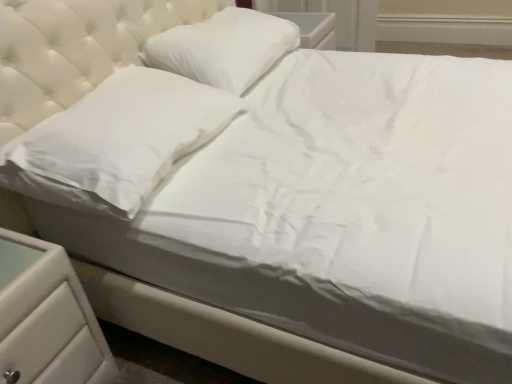
Question: From the image's perspective, does white smooth pillow at left, which appears as the second pillow when viewed from the back, appear lower than white smooth pillow at upper center, positioned as the first pillow in back-to-front order?

Choices:
 (A) no
 (B) yes

Answer: (B)

Question: Is white smooth pillow at left, which is the first pillow in front-to-back order, positioned in front of white smooth pillow at upper center, the 2th pillow from the front?

Choices:
 (A) no
 (B) yes

Answer: (B)

Question: Does white smooth pillow at left, which is the first pillow in front-to-back order, have a larger size compared to white smooth pillow at upper center, positioned as the first pillow in back-to-front order?

Choices:
 (A) no
 (B) yes

Answer: (A)

Question: Considering the relative sizes of white smooth pillow at left, which appears as the second pillow when viewed from the back, and white smooth pillow at upper center, positioned as the first pillow in back-to-front order, in the image provided, is white smooth pillow at left, which appears as the second pillow when viewed from the back, shorter than white smooth pillow at upper center, positioned as the first pillow in back-to-front order,?

Choices:
 (A) no
 (B) yes

Answer: (B)

Question: Considering the relative positions of white smooth pillow at left, which is the first pillow in front-to-back order, and white smooth pillow at upper center, the 2th pillow from the front, in the image provided, is white smooth pillow at left, which is the first pillow in front-to-back order, to the left of white smooth pillow at upper center, the 2th pillow from the front, from the viewer's perspective?

Choices:
 (A) no
 (B) yes

Answer: (B)

Question: Considering the relative sizes of white smooth pillow at left, which appears as the second pillow when viewed from the back, and white smooth pillow at upper center, the 2th pillow from the front, in the image provided, is white smooth pillow at left, which appears as the second pillow when viewed from the back, thinner than white smooth pillow at upper center, the 2th pillow from the front,?

Choices:
 (A) yes
 (B) no

Answer: (B)

Question: Is white plastic drawer at lower left with white smooth pillow at left, which is the first pillow in front-to-back order?

Choices:
 (A) no
 (B) yes

Answer: (A)

Question: Is white plastic drawer at lower left located outside white smooth pillow at left, which is the first pillow in front-to-back order?

Choices:
 (A) yes
 (B) no

Answer: (A)

Question: Considering the relative positions of white plastic drawer at lower left and white smooth pillow at left, which appears as the second pillow when viewed from the back, in the image provided, is white plastic drawer at lower left to the right of white smooth pillow at left, which appears as the second pillow when viewed from the back, from the viewer's perspective?

Choices:
 (A) no
 (B) yes

Answer: (A)

Question: Can you confirm if white plastic drawer at lower left is shorter than white smooth pillow at left, which is the first pillow in front-to-back order?

Choices:
 (A) yes
 (B) no

Answer: (B)

Question: From a real-world perspective, is white plastic drawer at lower left beneath white smooth pillow at left, which is the first pillow in front-to-back order?

Choices:
 (A) yes
 (B) no

Answer: (A)

Question: Can you confirm if white plastic drawer at lower left is smaller than white smooth pillow at left, which is the first pillow in front-to-back order?

Choices:
 (A) yes
 (B) no

Answer: (B)

Question: Does white plastic drawer at lower left appear on the right side of white smooth pillow at upper center, the 2th pillow from the front?

Choices:
 (A) no
 (B) yes

Answer: (A)